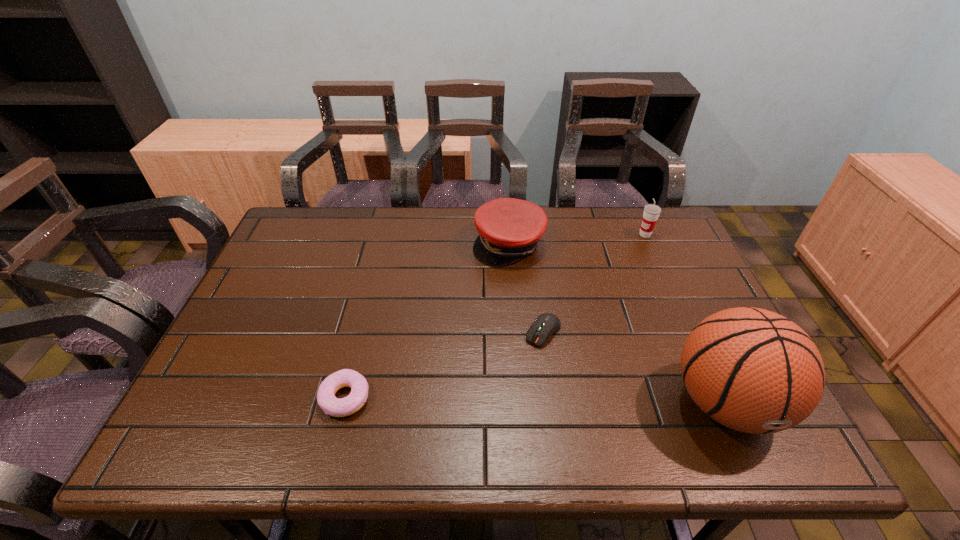
At what (x,y) coordinates should I click in order to perform the action: click on the leftmost object. Please return your answer as a coordinate pair (x, y). This screenshot has width=960, height=540. Looking at the image, I should click on (326, 399).

At what (x,y) coordinates should I click in order to perform the action: click on the tallest object. Please return your answer as a coordinate pair (x, y). Image resolution: width=960 pixels, height=540 pixels. Looking at the image, I should click on (755, 371).

Where is `computer equipment`? The width and height of the screenshot is (960, 540). computer equipment is located at coordinates (546, 324).

Identify the location of the third tallest object. (509, 229).

You are a GUI agent. You are given a task and a screenshot of the screen. Output one action in this format:
    pyautogui.click(x=<x>, y=<y>)
    Task: Click on the fourth shortest object
    This screenshot has height=540, width=960.
    Given the screenshot: What is the action you would take?
    pyautogui.click(x=651, y=212)

Find the location of a particular element. vacant space located on the back of the doughnut is located at coordinates (357, 352).

Identify the location of vacant point located 0.170m on the button of the third farthest object. (494, 394).

Image resolution: width=960 pixels, height=540 pixels. In order to click on vacant point located on the button of the third farthest object in this screenshot , I will do `click(497, 391)`.

This screenshot has height=540, width=960. What are the coordinates of `vacant space situated on the front-facing side of the cap` in the screenshot? It's located at (521, 307).

The image size is (960, 540). Identify the location of free space located 0.220m on the front-facing side of the cap. (525, 324).